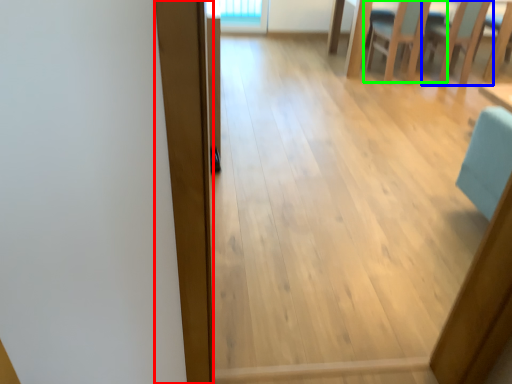
Question: Which is nearer to the plank (highlighted by a red box)? armchair (highlighted by a blue box) or chair (highlighted by a green box).

Choices:
 (A) armchair
 (B) chair

Answer: (B)